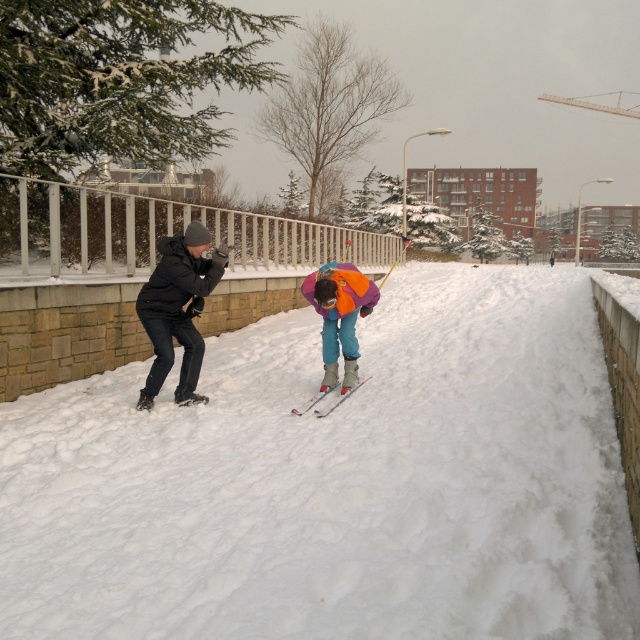
Where is `white fluffy snow at center`? This screenshot has height=640, width=640. white fluffy snow at center is located at coordinates (336, 481).

Between white fluffy snow at center and orange fleece jacket at center, which one is positioned higher?

orange fleece jacket at center is above.

You are a GUI agent. You are given a task and a screenshot of the screen. Output one action in this format:
    pyautogui.click(x=<x>, y=<y>)
    Task: Click on the white fluffy snow at center
    Image resolution: width=640 pixels, height=640 pixels.
    Given the screenshot: What is the action you would take?
    pyautogui.click(x=336, y=481)

Where is `white fluffy snow at center`? The width and height of the screenshot is (640, 640). white fluffy snow at center is located at coordinates (336, 481).

Does white fluffy snow at center appear under matte black jacket at left?

Yes, white fluffy snow at center is below matte black jacket at left.

Between white fluffy snow at center and matte black jacket at left, which one is positioned higher?

matte black jacket at left is above.

Measure the distance between point [436,516] and camera.

5.35 meters

Locate an element on the screen. The image size is (640, 640). white fluffy snow at center is located at coordinates (336, 481).

Is white fluffy snow at center bigger than dark gray matte jacket at left?

Indeed, white fluffy snow at center has a larger size compared to dark gray matte jacket at left.

Can you confirm if white fluffy snow at center is taller than dark gray matte jacket at left?

No.

Identify the location of white fluffy snow at center. The image size is (640, 640). (336, 481).

The height and width of the screenshot is (640, 640). I want to click on white fluffy snow at center, so pos(336,481).